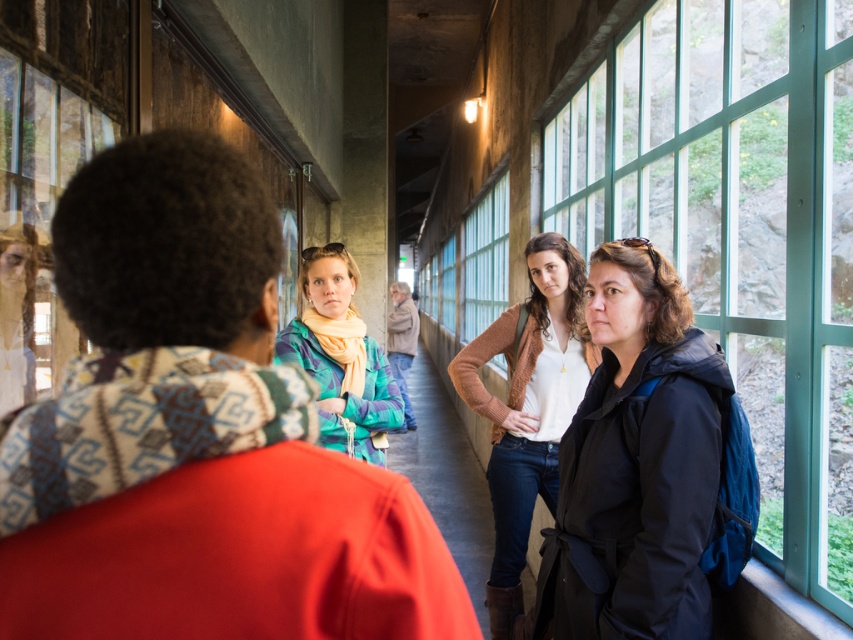
Which is more to the right, knit sweater at center or transparent glass window at upper left?

From the viewer's perspective, knit sweater at center appears more on the right side.

Can you confirm if knit sweater at center is smaller than transparent glass window at upper left?

No.

What do you see at coordinates (527, 406) in the screenshot? I see `knit sweater at center` at bounding box center [527, 406].

I want to click on knit sweater at center, so click(527, 406).

Can you confirm if knitted wool scarf at center is positioned above clear glass window at right?

No.

This screenshot has width=853, height=640. Describe the element at coordinates (196, 436) in the screenshot. I see `knitted wool scarf at center` at that location.

What do you see at coordinates (196, 436) in the screenshot? I see `knitted wool scarf at center` at bounding box center [196, 436].

Where is `knitted wool scarf at center`? knitted wool scarf at center is located at coordinates point(196,436).

Identify the location of knit sweater at center. This screenshot has height=640, width=853. (527, 406).

The width and height of the screenshot is (853, 640). I want to click on knit sweater at center, so click(x=527, y=406).